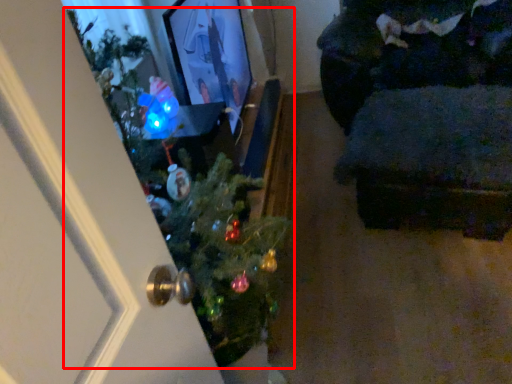
Question: From the image's perspective, where is christmas tree (annotated by the red box) located in relation to furniture in the image?

Choices:
 (A) above
 (B) below

Answer: (B)